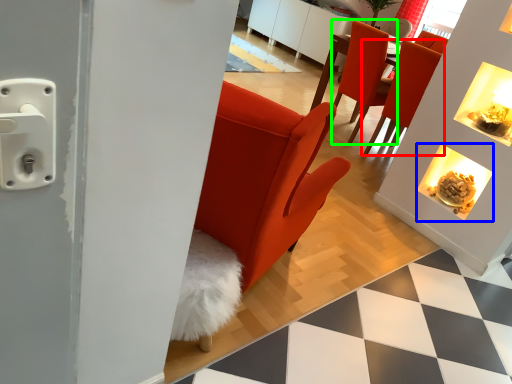
Question: Which is farther away from chair (highlighted by a red box)? fireplace (highlighted by a blue box) or chair (highlighted by a green box)?

Choices:
 (A) fireplace
 (B) chair

Answer: (A)